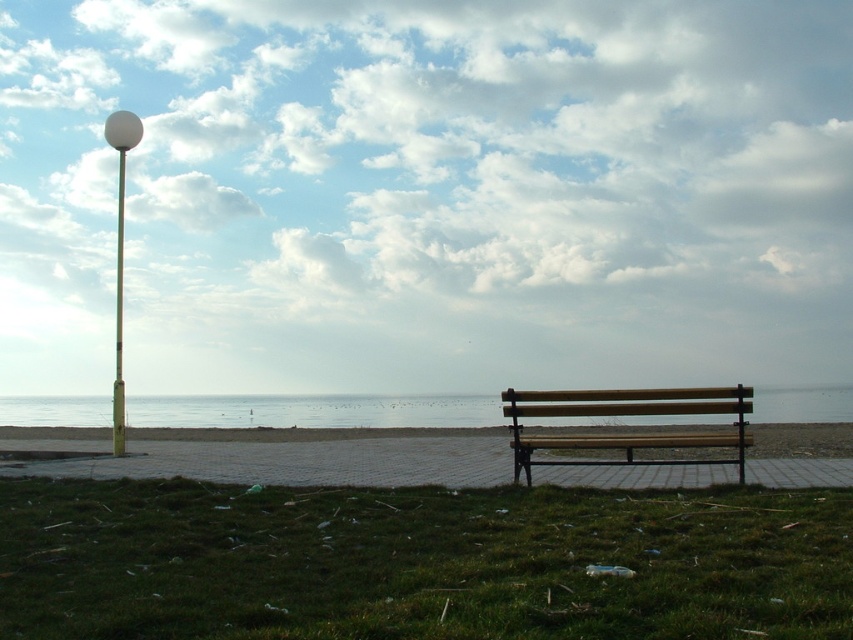
In the scene shown: Can you confirm if wooden bench at right is positioned above blue water at center?

Incorrect, wooden bench at right is not positioned above blue water at center.

Can you confirm if wooden bench at right is thinner than blue water at center?

Yes.

This screenshot has width=853, height=640. Find the location of `wooden bench at right`. wooden bench at right is located at coordinates (302, 458).

Locate an element on the screen. The height and width of the screenshot is (640, 853). wooden bench at right is located at coordinates (302, 458).

Is green grass at lower center shorter than wooden bench at center?

Yes.

Can you confirm if green grass at lower center is positioned to the left of wooden bench at center?

Yes, green grass at lower center is to the left of wooden bench at center.

Between point (515, 506) and point (677, 413), which one is positioned behind?

The point (677, 413) is behind.

What are the coordinates of `green grass at lower center` in the screenshot? It's located at (418, 563).

Does wooden bench at center have a lesser width compared to white glossy lamp post at upper left?

Correct, wooden bench at center's width is less than white glossy lamp post at upper left's.

Is wooden bench at center below white glossy lamp post at upper left?

Yes, wooden bench at center is below white glossy lamp post at upper left.

Is point (672, 410) positioned before point (126, 124)?

Yes, it is.

Locate an element on the screen. The width and height of the screenshot is (853, 640). wooden bench at center is located at coordinates (628, 416).